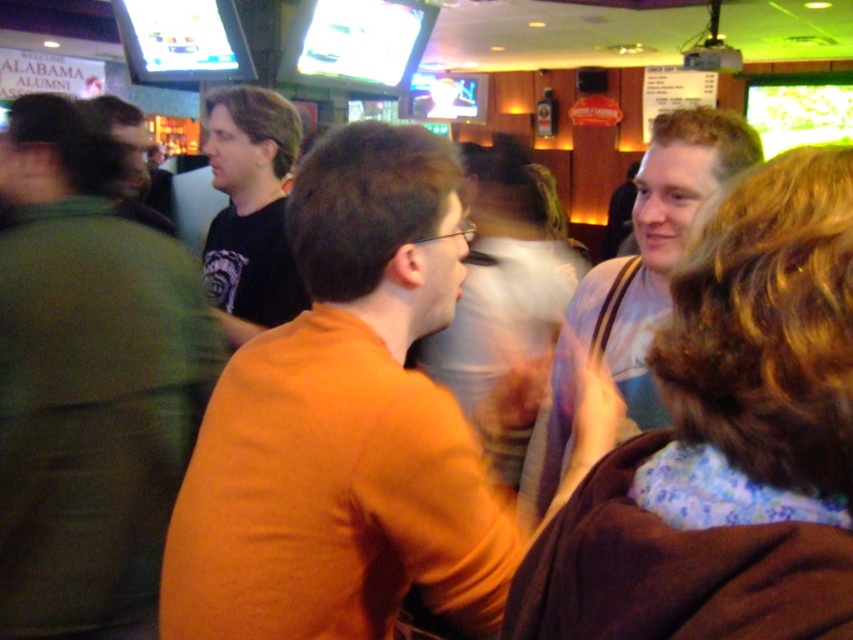
Question: Estimate the real-world distances between objects in this image. Which object is farther from the floral fabric dress at center?

Choices:
 (A) black matte shirt at center
 (B) dark brown hair at left
 (C) green cotton shirt at left
 (D) white cotton shirt at upper right

Answer: (B)

Question: Which is nearer to the green cotton shirt at left?

Choices:
 (A) black matte shirt at center
 (B) dark brown hair at left
 (C) white cotton shirt at upper right

Answer: (A)

Question: Which of the following is the closest to the observer?

Choices:
 (A) (119, 122)
 (B) (287, 168)

Answer: (B)

Question: Can you confirm if white cotton shirt at upper right is smaller than dark brown hair at left?

Choices:
 (A) no
 (B) yes

Answer: (B)

Question: Does orange matte shirt at center have a lesser width compared to black matte shirt at center?

Choices:
 (A) no
 (B) yes

Answer: (A)

Question: Does green cotton shirt at left appear over black matte shirt at center?

Choices:
 (A) no
 (B) yes

Answer: (A)